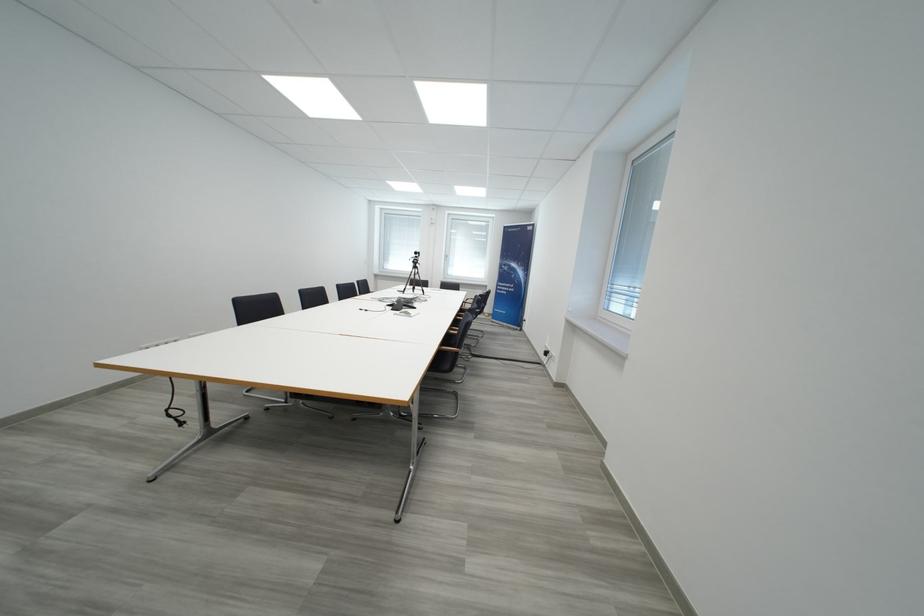
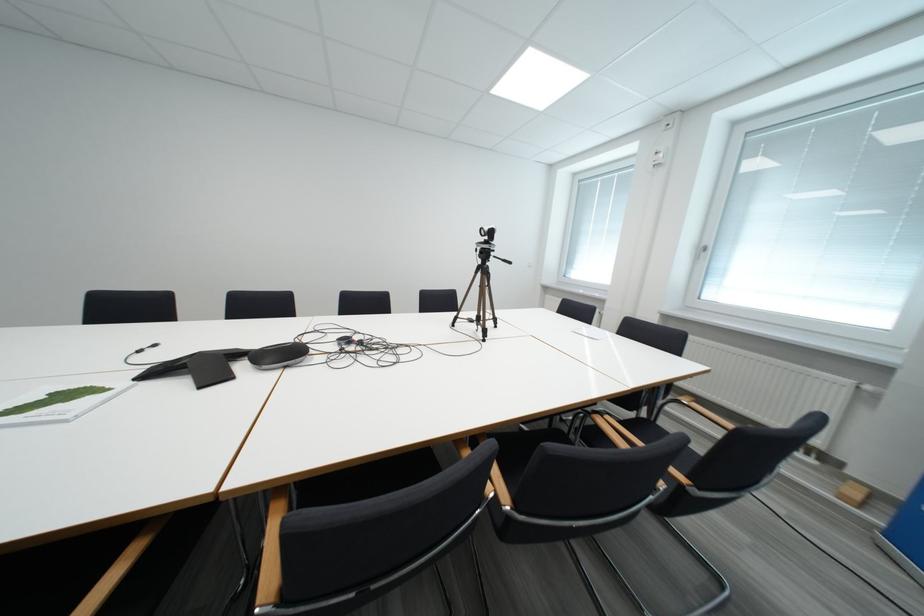
Where in the second image is the point corresponding to point (420, 291) from the first image?

(485, 322)